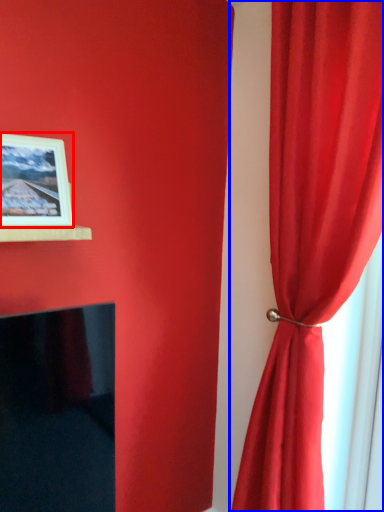
Question: Which point is further to the camera, picture frame (highlighted by a red box) or curtain (highlighted by a blue box)?

Choices:
 (A) picture frame
 (B) curtain

Answer: (A)